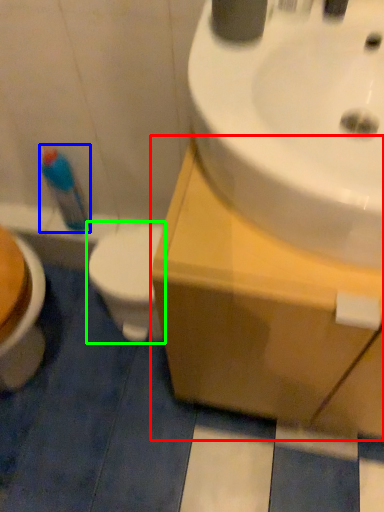
Question: Estimate the real-world distances between objects in this image. Which object is farther from counter top (highlighted by a red box), cleaning product (highlighted by a blue box) or toilet (highlighted by a green box)?

Choices:
 (A) cleaning product
 (B) toilet

Answer: (A)